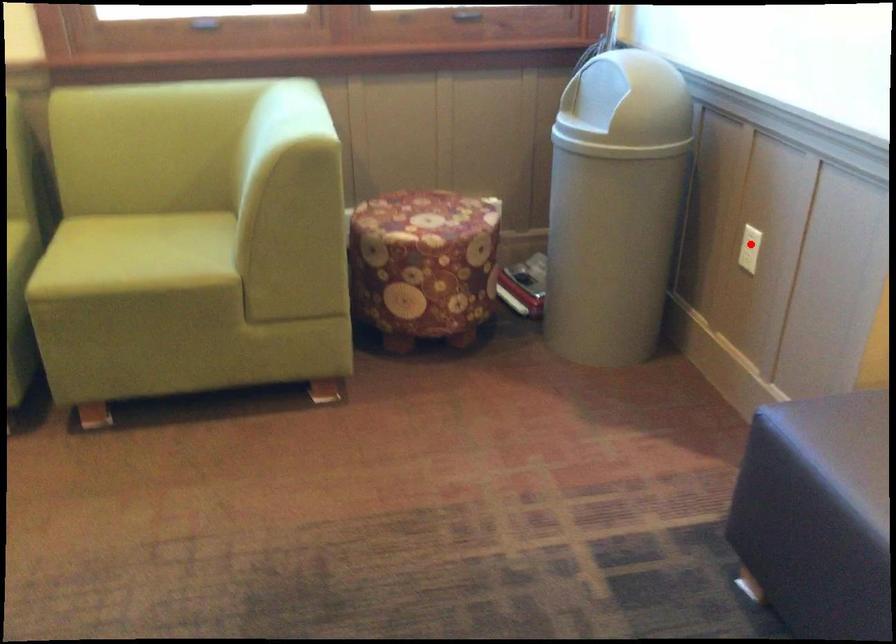
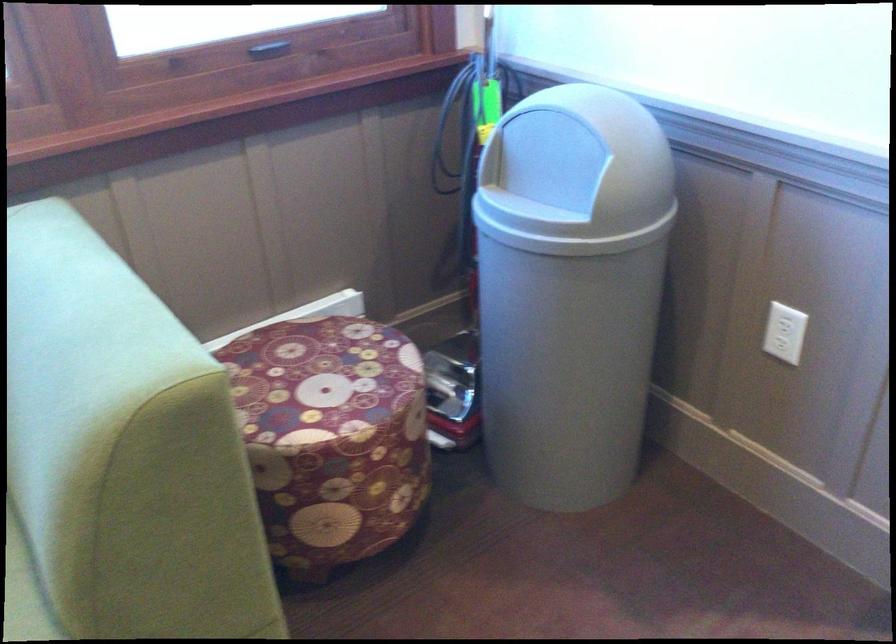
Question: I am providing you with two images of the same scene from different viewpoints. In image1, a red point is highlighted. Considering the same 3D point in image2, which of the following is correct?

Choices:
 (A) It is closer
 (B) It is farther

Answer: (A)